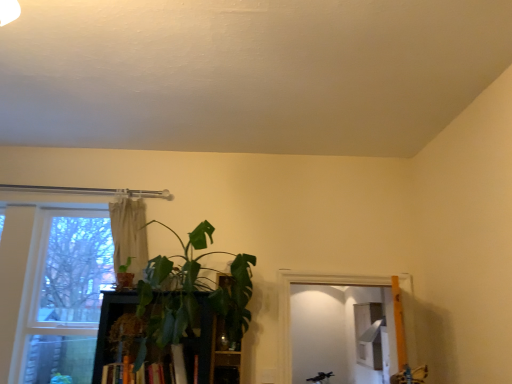
Question: Considering the relative sizes of green leafy plant at center, which is the 2th houseplant from left to right, and beige fabric curtain at upper center in the image provided, is green leafy plant at center, which is the 2th houseplant from left to right, shorter than beige fabric curtain at upper center?

Choices:
 (A) yes
 (B) no

Answer: (B)

Question: From a real-world perspective, is green leafy plant at center, which is counted as the first houseplant, starting from the right, physically below beige fabric curtain at upper center?

Choices:
 (A) no
 (B) yes

Answer: (B)

Question: Can we say green leafy plant at center, which is the 2th houseplant from left to right, lies outside beige fabric curtain at upper center?

Choices:
 (A) no
 (B) yes

Answer: (B)

Question: Is green leafy plant at center, which is counted as the first houseplant, starting from the right, far from beige fabric curtain at upper center?

Choices:
 (A) no
 (B) yes

Answer: (A)

Question: Does green leafy plant at center, which is counted as the first houseplant, starting from the right, have a smaller size compared to beige fabric curtain at upper center?

Choices:
 (A) yes
 (B) no

Answer: (B)

Question: Considering the positions of green leafy plant at center, which is counted as the first houseplant, starting from the right, and beige fabric curtain at upper center in the image, is green leafy plant at center, which is counted as the first houseplant, starting from the right, wider or thinner than beige fabric curtain at upper center?

Choices:
 (A) wide
 (B) thin

Answer: (A)

Question: Is point (152, 312) positioned closer to the camera than point (122, 210)?

Choices:
 (A) farther
 (B) closer

Answer: (B)

Question: Based on their positions, is green leafy plant at center, which is the 2th houseplant from left to right, located to the left or right of beige fabric curtain at upper center?

Choices:
 (A) left
 (B) right

Answer: (B)

Question: From a real-world perspective, is green leafy plant at center, which is the 2th houseplant from left to right, above or below beige fabric curtain at upper center?

Choices:
 (A) below
 (B) above

Answer: (A)

Question: In terms of height, does clear glass window at left look taller or shorter compared to hardcover book at center?

Choices:
 (A) short
 (B) tall

Answer: (B)

Question: Based on their sizes in the image, would you say clear glass window at left is bigger or smaller than hardcover book at center?

Choices:
 (A) small
 (B) big

Answer: (B)

Question: From the image's perspective, is clear glass window at left above or below hardcover book at center?

Choices:
 (A) below
 (B) above

Answer: (B)

Question: From a real-world perspective, relative to hardcover book at center, is clear glass window at left vertically above or below?

Choices:
 (A) below
 (B) above

Answer: (B)

Question: Considering the positions of green matte plant at left, the 1th houseplant when ordered from left to right, and hardcover book at center in the image, is green matte plant at left, the 1th houseplant when ordered from left to right, wider or thinner than hardcover book at center?

Choices:
 (A) thin
 (B) wide

Answer: (A)

Question: Does point (125, 266) appear closer or farther from the camera than point (142, 380)?

Choices:
 (A) closer
 (B) farther

Answer: (B)